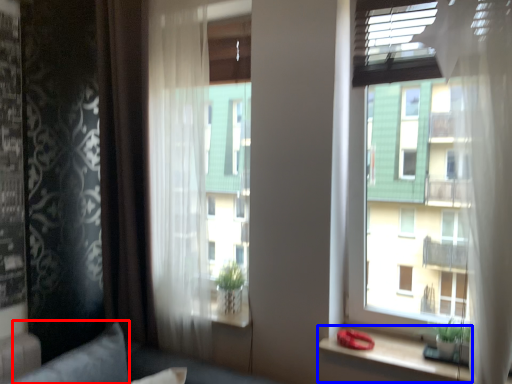
Question: Which point is further to the camera, pillow (highlighted by a red box) or window sill (highlighted by a blue box)?

Choices:
 (A) pillow
 (B) window sill

Answer: (B)